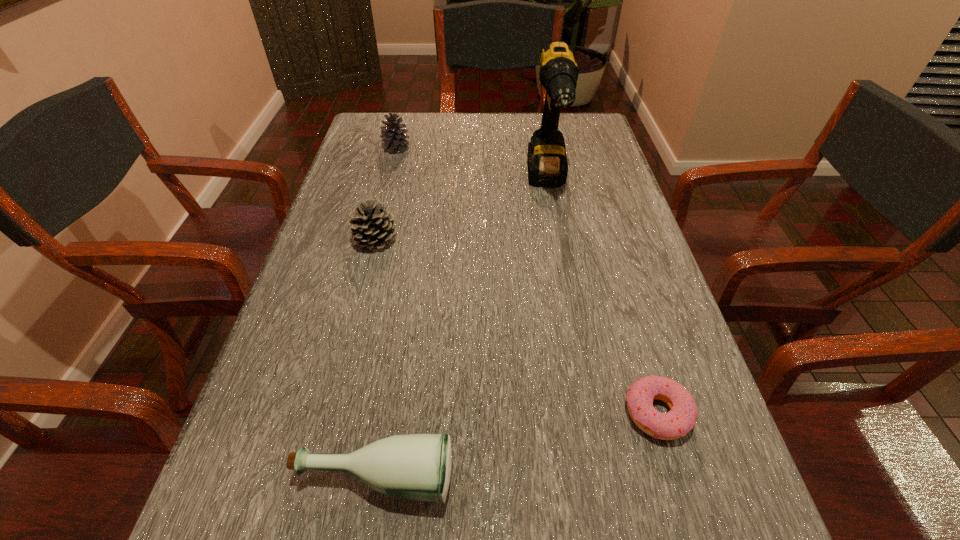
Find the location of `the tallest object`. the tallest object is located at coordinates (547, 163).

At what (x,y) coordinates should I click in order to perform the action: click on the second object from right to left. Please return your answer as a coordinate pair (x, y). Image resolution: width=960 pixels, height=540 pixels. Looking at the image, I should click on pyautogui.click(x=547, y=163).

At what (x,y) coordinates should I click in order to perform the action: click on the third nearest object. Please return your answer as a coordinate pair (x, y). Looking at the image, I should click on (373, 227).

The image size is (960, 540). I want to click on the farther pinecone, so click(394, 140).

Image resolution: width=960 pixels, height=540 pixels. What are the coordinates of `bottle` in the screenshot? It's located at 418,466.

Find the location of a particular element. This screenshot has height=540, width=960. the nearest object is located at coordinates (418, 466).

Locate an element on the screen. the shortest object is located at coordinates (681, 418).

Locate an element on the screen. doughnut is located at coordinates (681, 418).

The width and height of the screenshot is (960, 540). In order to click on free region located at the tip of the fourth object from left to right in this screenshot , I will do `click(569, 302)`.

You are a GUI agent. You are given a task and a screenshot of the screen. Output one action in this format:
    pyautogui.click(x=<x>, y=<y>)
    Task: Click on the vacant space situated on the front of the nearer pinecone
    
    Given the screenshot: What is the action you would take?
    pyautogui.click(x=343, y=373)